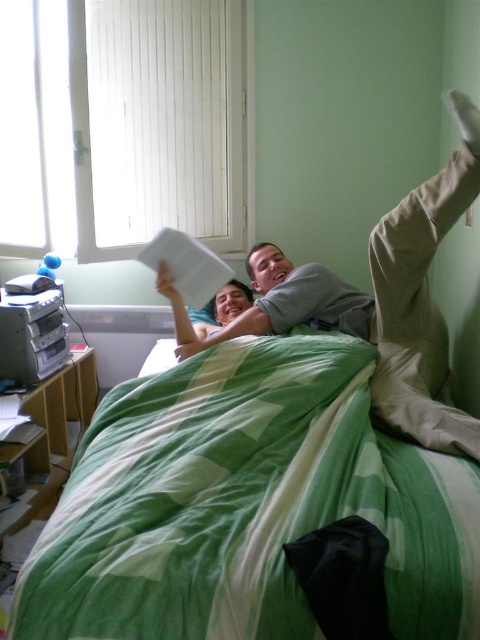
Question: Which of the following is the closest to the observer?

Choices:
 (A) gray cotton shirt at center
 (B) green printed fabric blanket at center

Answer: (B)

Question: Which object is farther from the camera taking this photo?

Choices:
 (A) gray cotton shirt at center
 (B) green printed fabric blanket at center

Answer: (A)

Question: Which object is closer to the camera taking this photo?

Choices:
 (A) green printed fabric blanket at center
 (B) gray cotton shirt at center

Answer: (A)

Question: Can you confirm if green printed fabric blanket at center is positioned below gray cotton shirt at center?

Choices:
 (A) no
 (B) yes

Answer: (B)

Question: Is green printed fabric blanket at center wider than gray cotton shirt at center?

Choices:
 (A) no
 (B) yes

Answer: (B)

Question: Can you confirm if green printed fabric blanket at center is positioned to the right of gray cotton shirt at center?

Choices:
 (A) yes
 (B) no

Answer: (B)